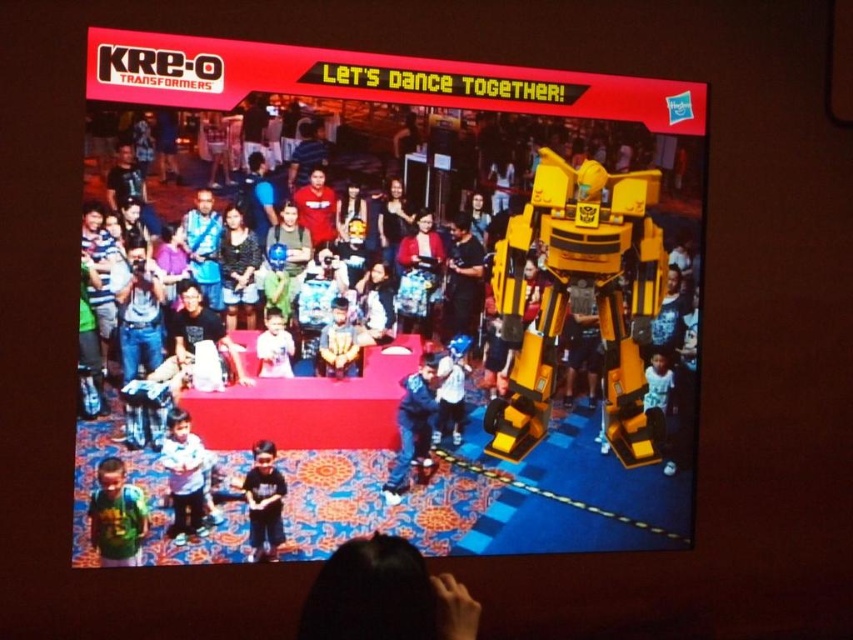
Who is lower down, light blue shirt at lower left or smooth skin face at center?

light blue shirt at lower left

Who is more forward, [178,467] or [341,356]?

Positioned in front is point [178,467].

Between point (207, 468) and point (332, 355), which one is positioned behind?

Positioned behind is point (332, 355).

The image size is (853, 640). Find the location of `light blue shirt at lower left`. light blue shirt at lower left is located at coordinates (184, 477).

This screenshot has height=640, width=853. I want to click on matte yellow robot at center, so click(415, 332).

Find the location of a particular element. This screenshot has width=853, height=640. matte yellow robot at center is located at coordinates (415, 332).

Measure the distance between point (117, 496) and camera.

Point (117, 496) is 3.70 meters from camera.

Is green jersey at lower left in front of smooth skin face at center?

Yes, green jersey at lower left is in front of smooth skin face at center.

Between point (109, 484) and point (339, 355), which one is positioned in front?

Point (109, 484) is in front.

Where is `green jersey at lower left`? The width and height of the screenshot is (853, 640). green jersey at lower left is located at coordinates (115, 516).